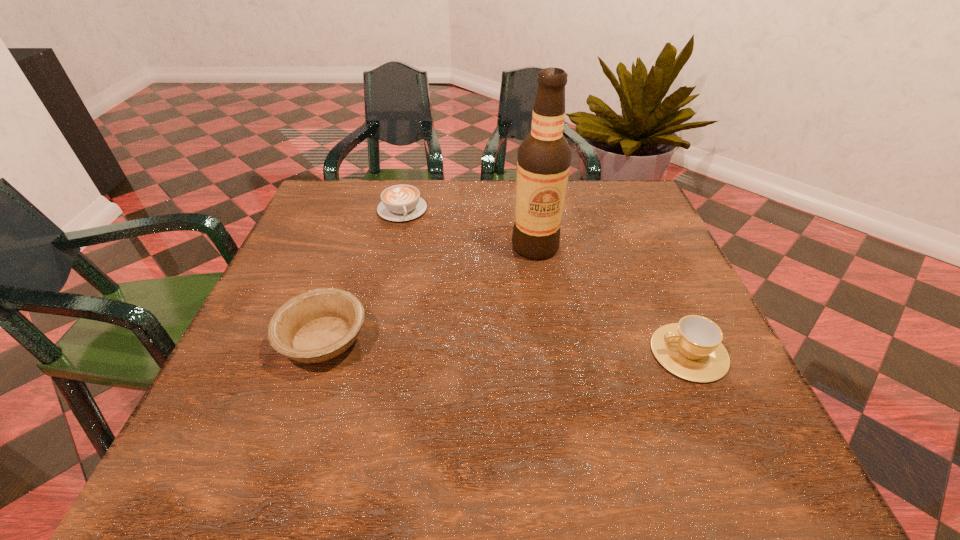
Locate an element on the screen. This screenshot has height=540, width=960. object that is at the right edge is located at coordinates (691, 349).

Where is `object present at the near left corner`? object present at the near left corner is located at coordinates [318, 325].

Identify the location of object at the near right corner. The height and width of the screenshot is (540, 960). click(x=691, y=349).

This screenshot has width=960, height=540. What are the coordinates of `free space at the far edge of the desktop` in the screenshot? It's located at (492, 207).

Image resolution: width=960 pixels, height=540 pixels. I want to click on vacant space at the near edge of the desktop, so click(x=334, y=392).

Identify the location of vacant space at the left edge of the desktop. This screenshot has height=540, width=960. (324, 235).

Image resolution: width=960 pixels, height=540 pixels. Identify the location of blank space at the right edge of the desktop. (642, 258).

Where is `vacant space at the far left corner of the desktop`? The image size is (960, 540). vacant space at the far left corner of the desktop is located at coordinates (360, 197).

Image resolution: width=960 pixels, height=540 pixels. Identify the location of vacant space at the far right corner. (623, 184).

In order to click on free spot between the rightmost object and the bowl in this screenshot , I will do `click(506, 346)`.